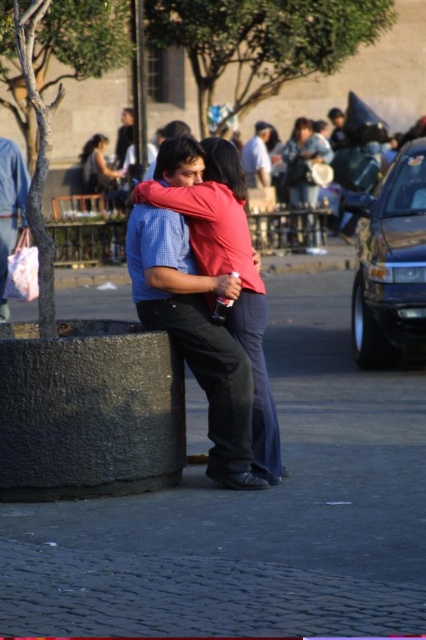
You are standing at the point marked as point (5, 252) in the image, which is 14.86 meters away from the camera. If you want to take a photo of the embracing couple in the foreground, will you be able to capture them clearly in your shot?

The point (5, 252) is 14.86 meters away from the camera. Since the embracing couple is in the foreground, they are closer to the camera than this point. Therefore, when you are at this point, the couple would be in the background of your photo, potentially making them appear smaller and less clear. However, modern cameras can often still capture distant subjects with some clarity depending on zoom capabilities.

You are an observer looking at the scene. You notice the matte pink sweater at upper center and the light blue shirt at center. Which one is positioned lower in the image?

The matte pink sweater at upper center is located below the light blue shirt at center, so it is positioned lower in the image.